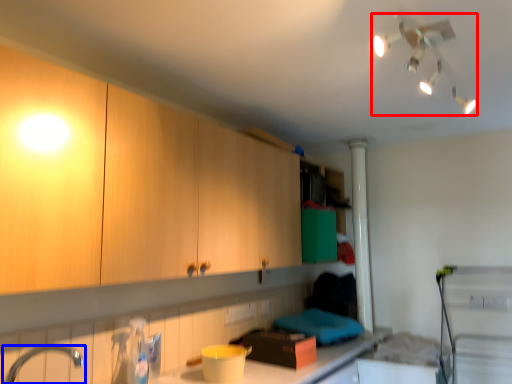
Question: Which of the following is the closest to the observer, light fixture (highlighted by a red box) or tap (highlighted by a blue box)?

Choices:
 (A) light fixture
 (B) tap

Answer: (A)